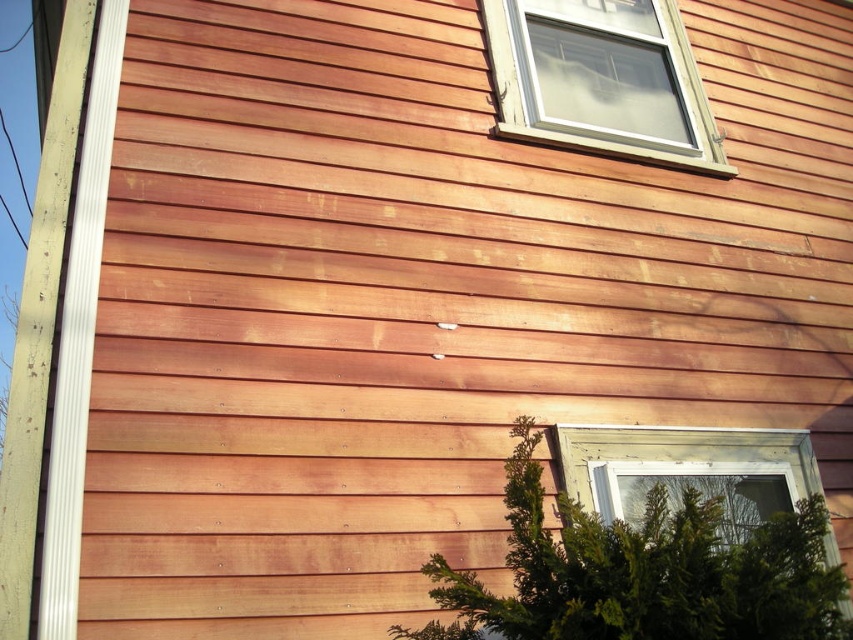
Question: Is white plastic window at upper right wider than white painted wood trim at left?

Choices:
 (A) yes
 (B) no

Answer: (A)

Question: Which of the following is the closest to the observer?

Choices:
 (A) (788, 451)
 (B) (642, 40)

Answer: (A)

Question: Which object appears closest to the camera in this image?

Choices:
 (A) white plastic window at upper right
 (B) white painted wood trim at left

Answer: (B)

Question: Can you confirm if white plastic window at upper right is bigger than white painted wood trim at left?

Choices:
 (A) yes
 (B) no

Answer: (A)

Question: Can you confirm if white plastic window at upper right is positioned above clear glass window at lower right?

Choices:
 (A) no
 (B) yes

Answer: (B)

Question: Which of these objects is positioned closest to the clear glass window at lower right?

Choices:
 (A) white painted wood trim at left
 (B) white plastic window at upper right

Answer: (A)